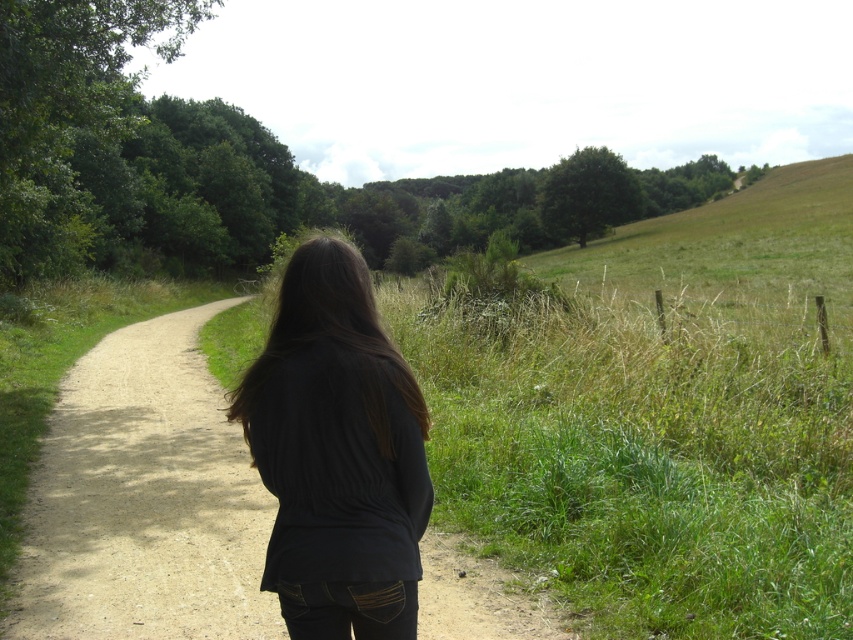
You are a photographer setting up a shot of the dirt path at center and the black matte shirt at center. Which object is closer to the camera?

The black matte shirt at center is closer to the camera because the dirt path at center is positioned under it.

You are standing at the edge of the dirt path in the rural scene. You see two points marked on the path. One is at coordinate point (102,627) and the other at point (364,392). Which point is closer to you as you face the direction the person is facing?

Point (364,392) is closer to you because point (102,627) is behind it.